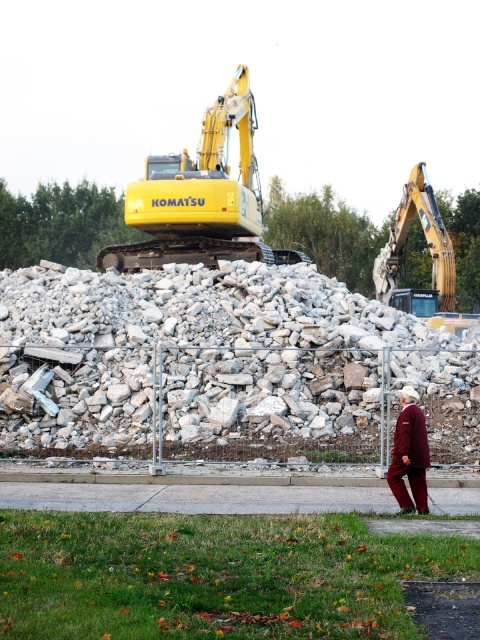
Question: Which point is closer to the camera?

Choices:
 (A) (445, 333)
 (B) (444, 269)

Answer: (A)

Question: Does white gravel at center appear under yellow metallic excavator at upper right?

Choices:
 (A) no
 (B) yes

Answer: (B)

Question: Which point is closer to the camera taking this photo?

Choices:
 (A) (91, 296)
 (B) (386, 298)
 (C) (242, 93)
 (D) (407, 451)

Answer: (D)

Question: Which object appears closest to the camera in this image?

Choices:
 (A) yellow metallic excavator at upper right
 (B) maroon fabric robe at lower right

Answer: (B)

Question: Does yellow metallic excavator at upper center have a lesser width compared to maroon fabric robe at lower right?

Choices:
 (A) yes
 (B) no

Answer: (B)

Question: In this image, where is yellow metallic excavator at upper right located relative to maroon fabric robe at lower right?

Choices:
 (A) below
 (B) above

Answer: (B)